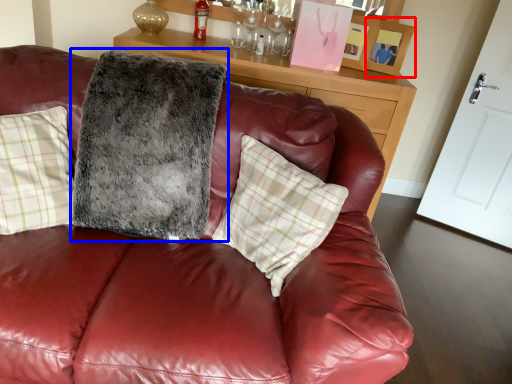
Question: Which point is further to the camera, picture frame (highlighted by a red box) or blanket (highlighted by a blue box)?

Choices:
 (A) picture frame
 (B) blanket

Answer: (A)